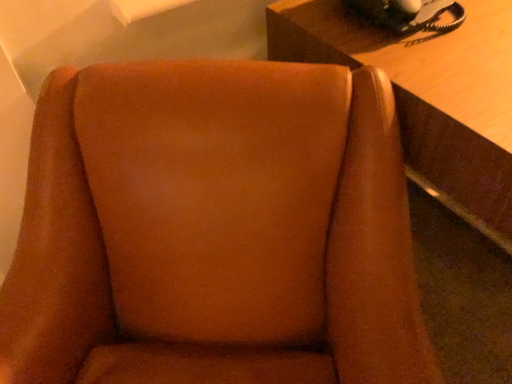
Question: Considering the relative sizes of brown suede chair at center and black rubberized phone at upper right in the image provided, is brown suede chair at center wider than black rubberized phone at upper right?

Choices:
 (A) yes
 (B) no

Answer: (A)

Question: Considering the relative positions of brown suede chair at center and black rubberized phone at upper right in the image provided, is brown suede chair at center to the right of black rubberized phone at upper right from the viewer's perspective?

Choices:
 (A) no
 (B) yes

Answer: (A)

Question: From the image's perspective, would you say brown suede chair at center is positioned over black rubberized phone at upper right?

Choices:
 (A) yes
 (B) no

Answer: (B)

Question: Can you confirm if brown suede chair at center is smaller than black rubberized phone at upper right?

Choices:
 (A) yes
 (B) no

Answer: (B)

Question: Can you confirm if brown suede chair at center is taller than black rubberized phone at upper right?

Choices:
 (A) yes
 (B) no

Answer: (A)

Question: Considering the positions of point (424, 16) and point (443, 74), is point (424, 16) closer or farther from the camera than point (443, 74)?

Choices:
 (A) farther
 (B) closer

Answer: (A)

Question: Is black rubberized phone at upper right wider or thinner than wooden table at upper right?

Choices:
 (A) thin
 (B) wide

Answer: (A)

Question: From the image's perspective, is black rubberized phone at upper right positioned above or below wooden table at upper right?

Choices:
 (A) below
 (B) above

Answer: (B)

Question: Is black rubberized phone at upper right inside or outside of wooden table at upper right?

Choices:
 (A) outside
 (B) inside

Answer: (A)

Question: Looking at their shapes, would you say brown suede chair at center is wider or thinner than black rubberized phone at upper right?

Choices:
 (A) thin
 (B) wide

Answer: (B)

Question: Relative to black rubberized phone at upper right, is brown suede chair at center in front or behind?

Choices:
 (A) behind
 (B) front

Answer: (B)

Question: Is brown suede chair at center taller or shorter than black rubberized phone at upper right?

Choices:
 (A) tall
 (B) short

Answer: (A)

Question: From a real-world perspective, is brown suede chair at center positioned above or below black rubberized phone at upper right?

Choices:
 (A) above
 (B) below

Answer: (B)

Question: In the image, is brown suede chair at center on the left side or the right side of wooden table at upper right?

Choices:
 (A) right
 (B) left

Answer: (B)

Question: In the image, is brown suede chair at center positioned in front of or behind wooden table at upper right?

Choices:
 (A) behind
 (B) front

Answer: (B)